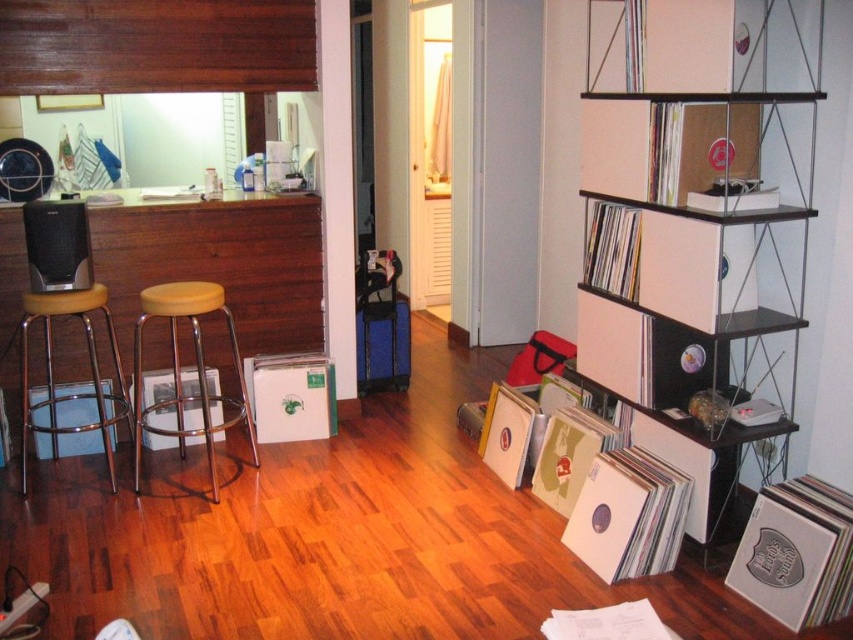
Who is positioned more to the right, white cardboard shelf at upper right or yellow matte bar stool at left?

white cardboard shelf at upper right is more to the right.

Between white cardboard shelf at upper right and yellow matte bar stool at left, which one is positioned higher?

white cardboard shelf at upper right is higher up.

What do you see at coordinates (672, 141) in the screenshot? I see `white cardboard shelf at upper right` at bounding box center [672, 141].

This screenshot has width=853, height=640. What are the coordinates of `white cardboard shelf at upper right` in the screenshot? It's located at (672, 141).

This screenshot has width=853, height=640. What do you see at coordinates (219, 264) in the screenshot? I see `brown wood stool at left` at bounding box center [219, 264].

Consider the image. Measure the distance between brown wood stool at left and camera.

brown wood stool at left and camera are 3.25 meters apart.

At what (x,y) coordinates should I click in order to perform the action: click on brown wood stool at left. Please return your answer as a coordinate pair (x, y). Looking at the image, I should click on (219, 264).

Locate an element on the screen. brown wood stool at left is located at coordinates (219, 264).

Which of these two, brown wood stool at left or white plastic shelf at upper right, stands taller?

brown wood stool at left

Between point (282, 269) and point (697, 300), which one is positioned behind?

The point (282, 269) is more distant.

Find the location of `brown wood stool at left`. brown wood stool at left is located at coordinates (219, 264).